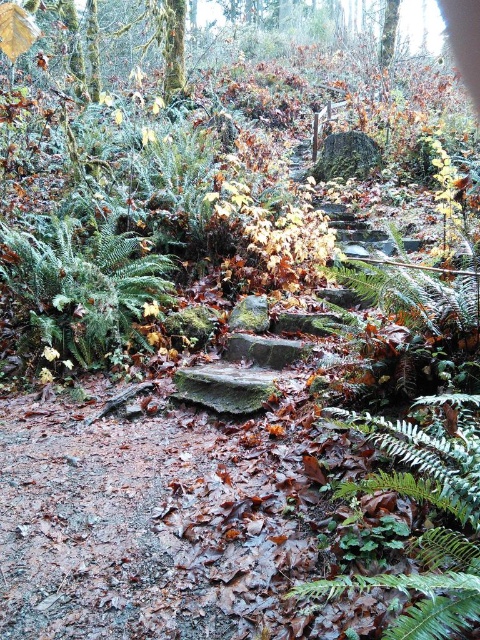
Which is more to the left, green matte fern at center or green matte fern at left?

Positioned to the left is green matte fern at left.

Who is taller, green matte fern at center or green matte fern at left?

With more height is green matte fern at left.

This screenshot has height=640, width=480. I want to click on green matte fern at center, so click(430, 458).